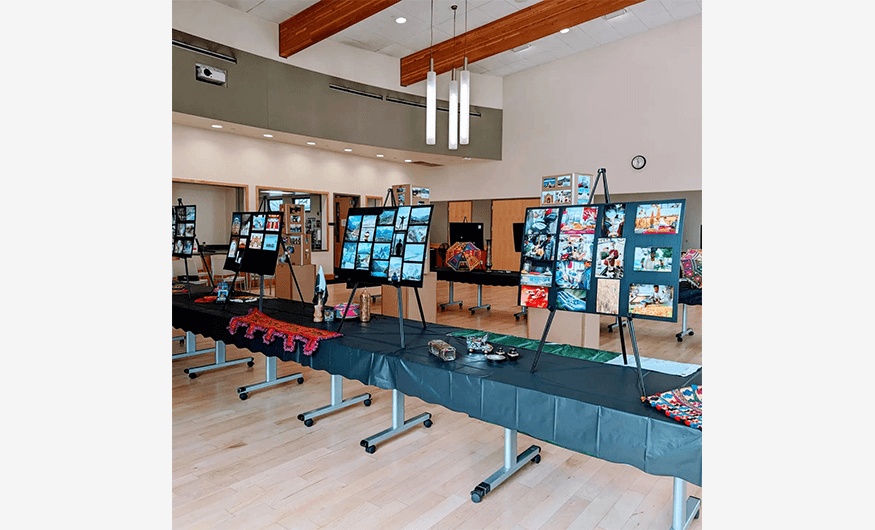
At what (x,y) coordinates should I click in order to perform the action: click on table top. Please return your answer as a coordinate pair (x, y). The width and height of the screenshot is (875, 530). Looking at the image, I should click on (584, 376).